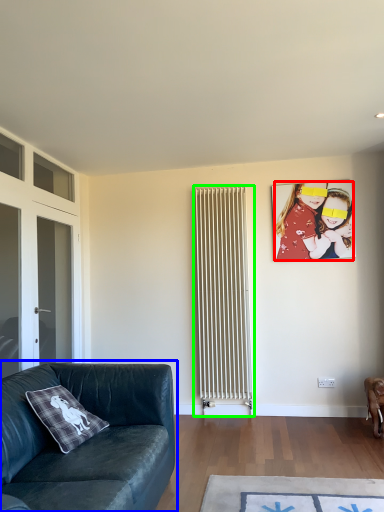
Question: Which object is positioned farthest from person (highlighted by a red box)? Select from studio couch (highlighted by a blue box) and radiator (highlighted by a green box).

Choices:
 (A) studio couch
 (B) radiator

Answer: (A)